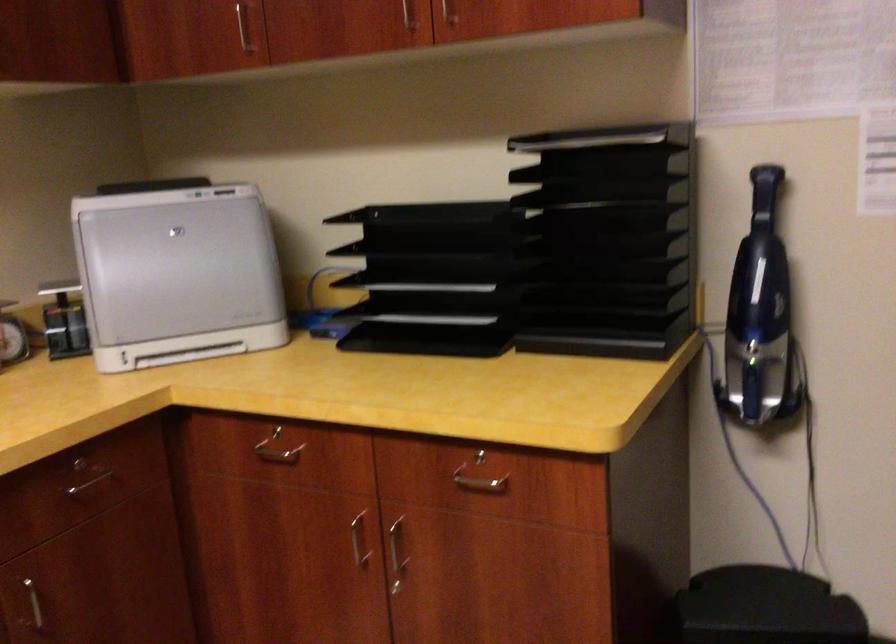
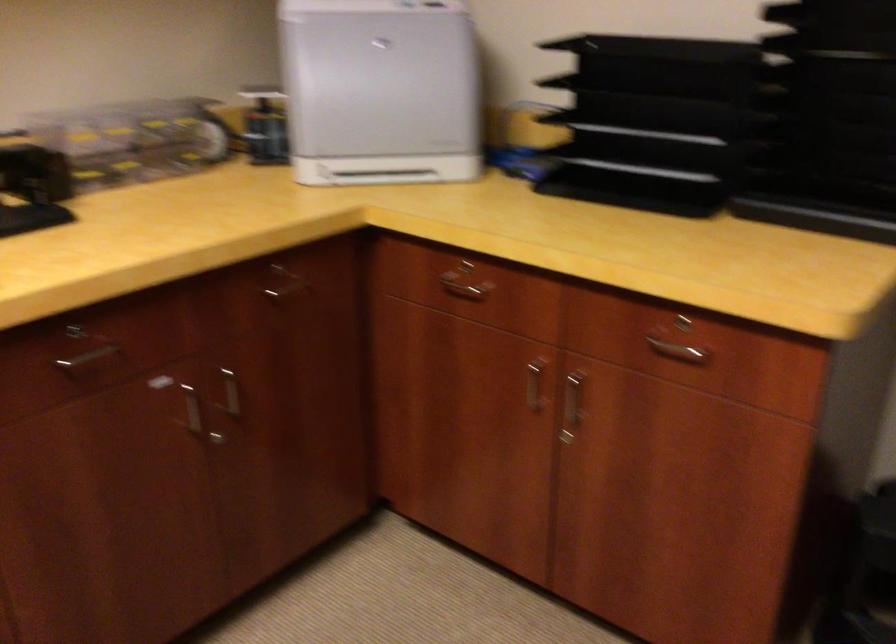
Where in the second image is the point corresponding to point (576, 238) from the first image?

(823, 93)